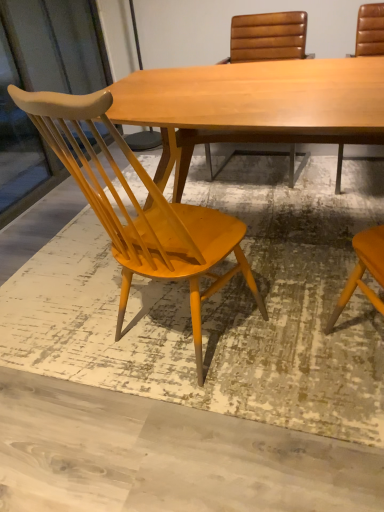
Identify the location of vacant space to the left of matte yellow wood chair at left, the 3th chair positioned from the right. Image resolution: width=384 pixels, height=512 pixels. (66, 330).